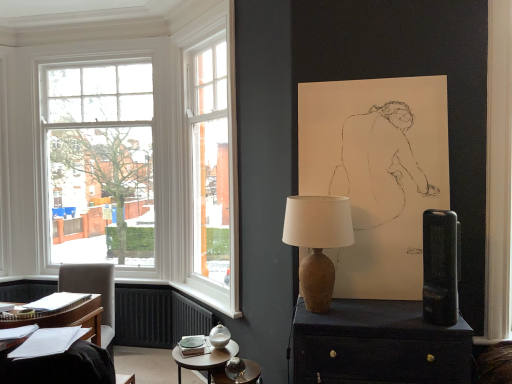
Locate an element on the screen. The width and height of the screenshot is (512, 384). vacant area situated below black plastic speaker at right (from a real-world perspective) is located at coordinates [441, 328].